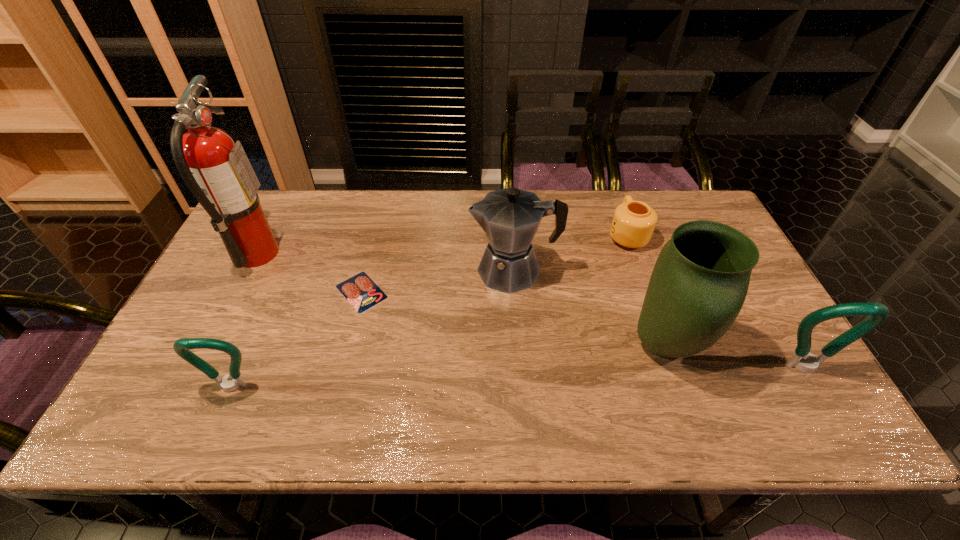
Identify the location of object that is the second closest to the coffeepot. The width and height of the screenshot is (960, 540). (633, 223).

Locate an element on the screen. free spot that satisfies the following two spatial constraints: 1. on the back side of the shortest object; 2. on the nozzle side of the fire extinguisher is located at coordinates (371, 254).

Locate an element on the screen. The height and width of the screenshot is (540, 960). blank space that satisfies the following two spatial constraints: 1. on the nozzle side of the tallest object; 2. on the left side of the third object from left to right is located at coordinates (237, 292).